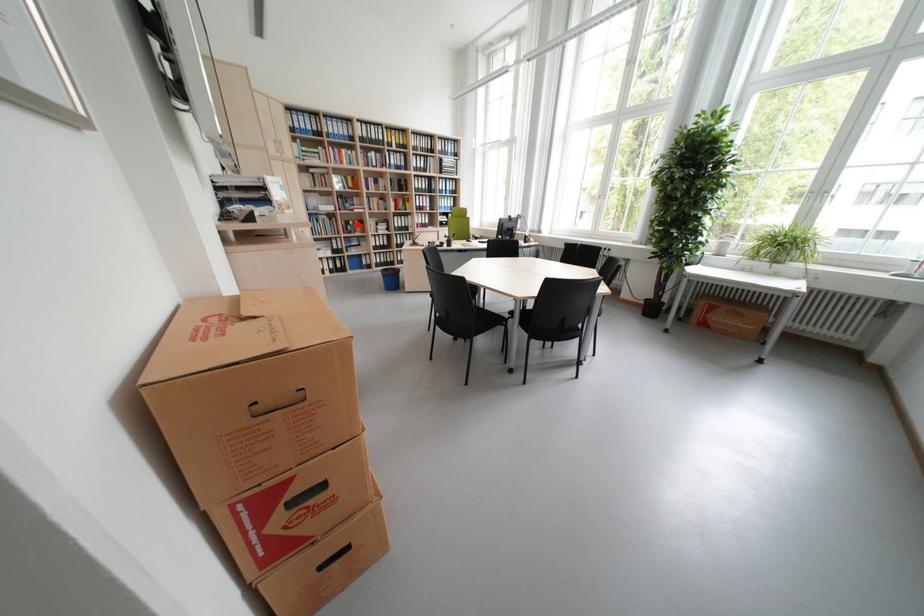
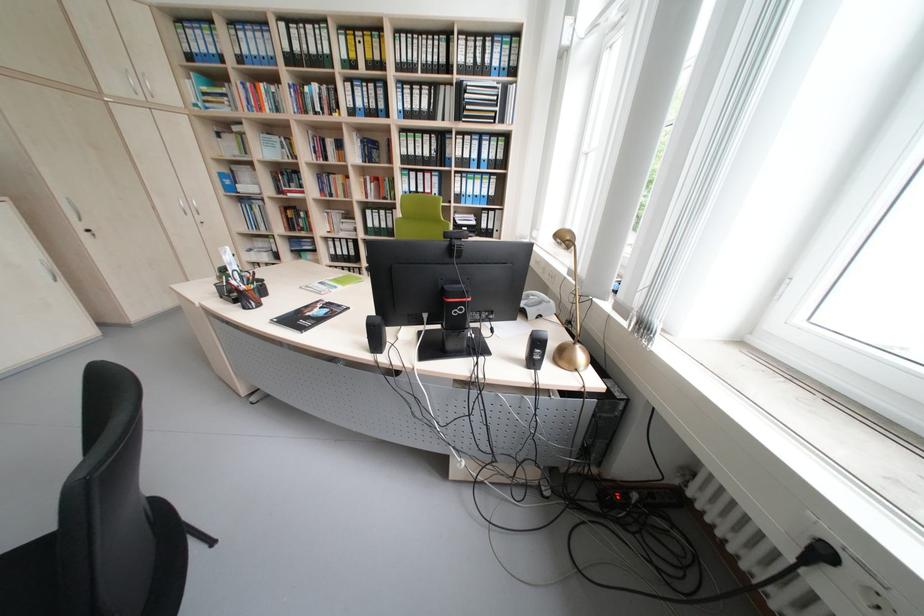
Question: I am providing you with two images of the same scene from different viewpoints. A red point is marked on the first image. At the location where the point appears in image 1, is it still visible in image 2?

Choices:
 (A) Yes
 (B) No

Answer: (A)